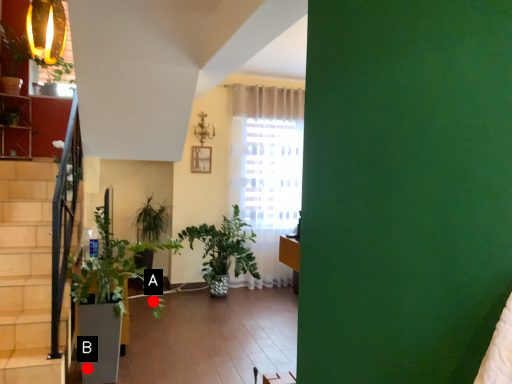
Question: Two points are circled on the image, labeled by A and B beside each circle. Which of the following is the farthest from the observer?

Choices:
 (A) A is further
 (B) B is further

Answer: (A)